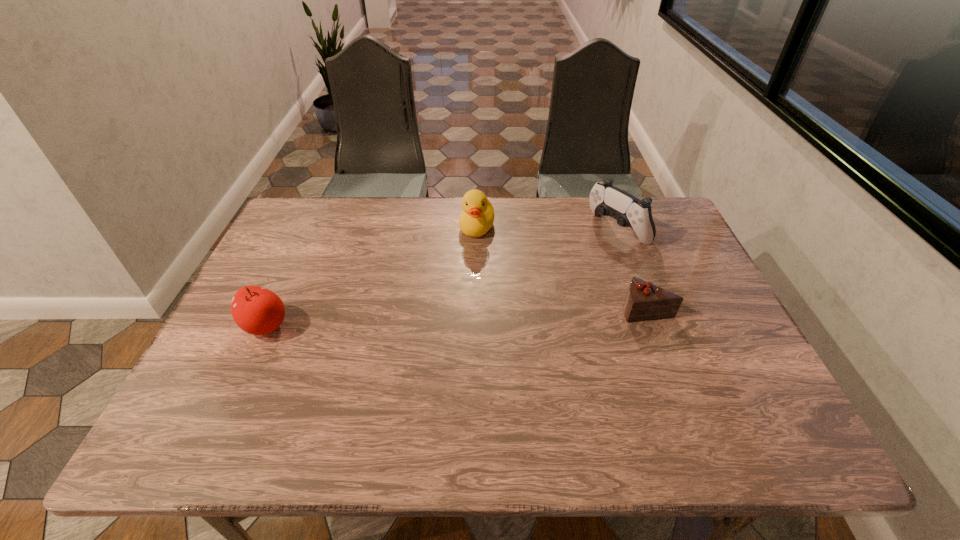
I want to click on vacant space on the desktop that is between the apple and the shortest object and is positioned on the front-facing side of the control, so click(x=473, y=316).

Where is `free spot on the desktop that is between the apple and the shortest object and is positioned at the beak of the duck`? Image resolution: width=960 pixels, height=540 pixels. free spot on the desktop that is between the apple and the shortest object and is positioned at the beak of the duck is located at coordinates (436, 318).